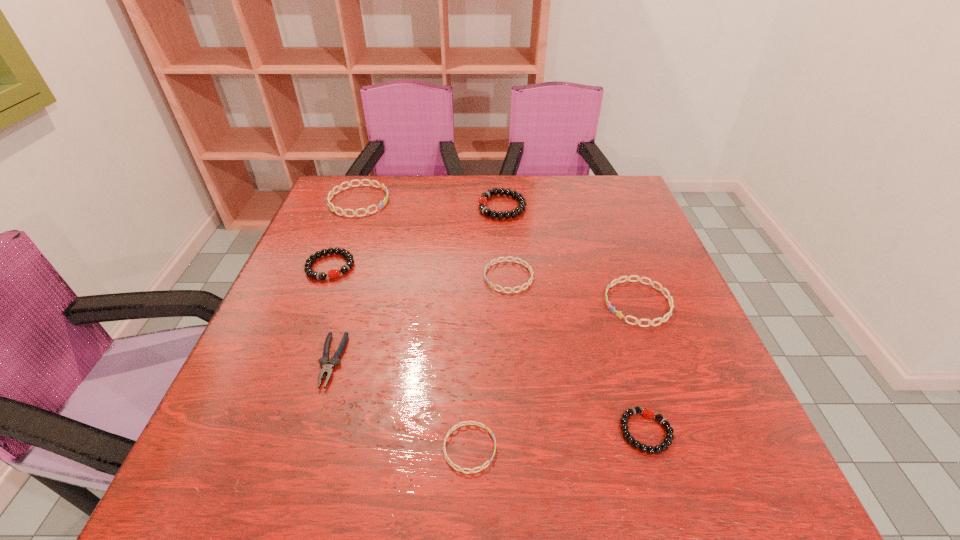
You are a GUI agent. You are given a task and a screenshot of the screen. Output one action in this format:
    pyautogui.click(x=<x>, y=<y>)
    Task: Click on the smallest black bracelet
    
    Given the screenshot: What is the action you would take?
    point(667,441)

Find the location of a particular element. The image size is (960, 540). the rightmost black bracelet is located at coordinates (667, 441).

Where is `the smallest blue bracelet`? This screenshot has width=960, height=540. the smallest blue bracelet is located at coordinates (456, 426).

In order to click on the shortest bracelet in this screenshot , I will do `click(456, 426)`.

Where is `blank area located 0.130m on the surface of the leftmost blue bracelet showing star-shaped elements`? Image resolution: width=960 pixels, height=540 pixels. blank area located 0.130m on the surface of the leftmost blue bracelet showing star-shaped elements is located at coordinates coord(433,201).

What are the coordinates of `free region located 0.080m on the left of the farthest black bracelet` in the screenshot? It's located at (450, 207).

Where is `vacant region located on the surface of the rightmost blue bracelet showing star-shaped elements`? Image resolution: width=960 pixels, height=540 pixels. vacant region located on the surface of the rightmost blue bracelet showing star-shaped elements is located at coordinates (530, 303).

Where is `free space located on the surface of the rightmost blue bracelet showing star-shaped elements`? The image size is (960, 540). free space located on the surface of the rightmost blue bracelet showing star-shaped elements is located at coordinates (516, 303).

I want to click on free point located on the surface of the rightmost blue bracelet showing star-shaped elements, so click(512, 303).

Where is `vacant space positioned 0.290m on the right of the second nearest black bracelet`? Image resolution: width=960 pixels, height=540 pixels. vacant space positioned 0.290m on the right of the second nearest black bracelet is located at coordinates (472, 266).